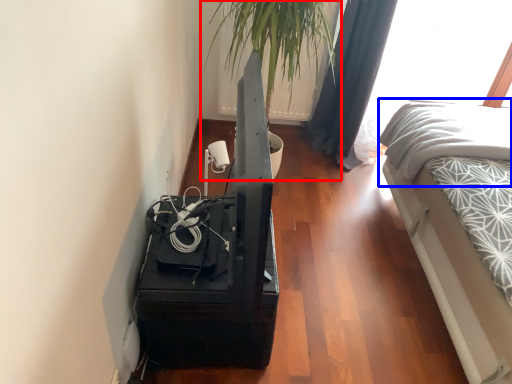
Question: Which of the following is the farthest to the observer, houseplant (highlighted by a red box) or bedding (highlighted by a blue box)?

Choices:
 (A) houseplant
 (B) bedding

Answer: (B)